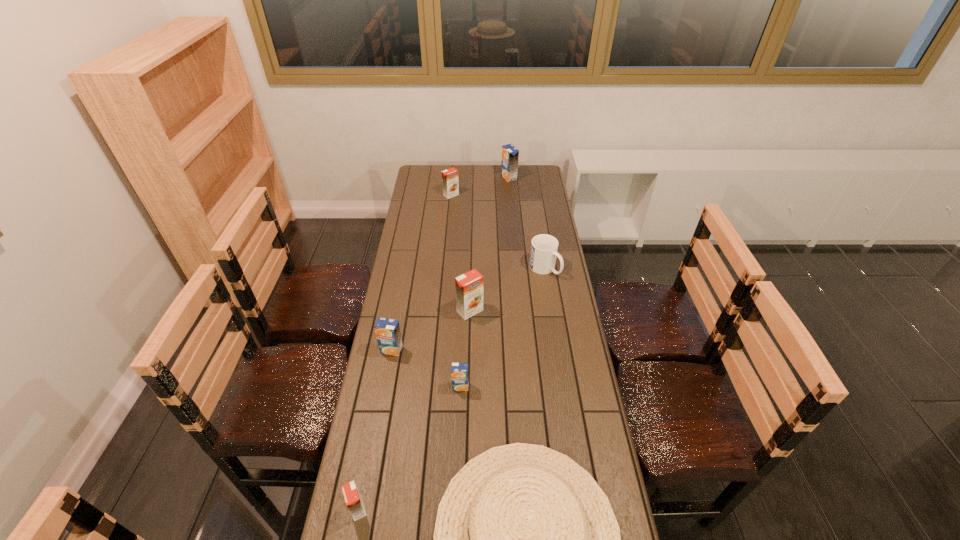
Locate an element on the screen. the farthest object is located at coordinates (510, 154).

You are a GUI agent. You are given a task and a screenshot of the screen. Output one action in this format:
    pyautogui.click(x=<x>, y=<y>)
    Task: Click on the farthest orange juice
    
    Given the screenshot: What is the action you would take?
    pyautogui.click(x=510, y=154)

Find the location of `the fourth nearest orange juice`. the fourth nearest orange juice is located at coordinates (469, 286).

At what (x,y) coordinates should I click in order to perform the action: click on the second nearest orange orange juice. Please return your answer as a coordinate pair (x, y). Looking at the image, I should click on (469, 286).

Where is `the third orange juice from left to right`? The width and height of the screenshot is (960, 540). the third orange juice from left to right is located at coordinates (450, 182).

At what (x,y) coordinates should I click in order to perform the action: click on the farthest orange orange juice. Please return your answer as a coordinate pair (x, y). Looking at the image, I should click on (450, 182).

At what (x,y) coordinates should I click in order to perform the action: click on the second smallest blue orange_juice. Please return your answer as a coordinate pair (x, y). The image size is (960, 540). Looking at the image, I should click on (388, 334).

I want to click on the second farthest blue orange_juice, so click(x=388, y=334).

Find the location of a particular element. The image size is (960, 540). blue mug is located at coordinates (544, 247).

The image size is (960, 540). What are the coordinates of `the third farthest object` in the screenshot? It's located at (544, 247).